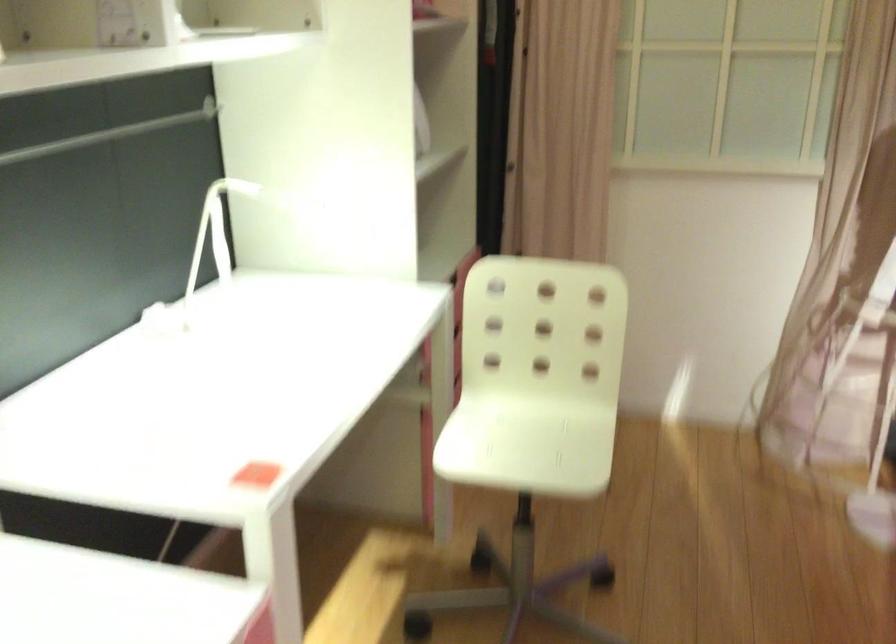
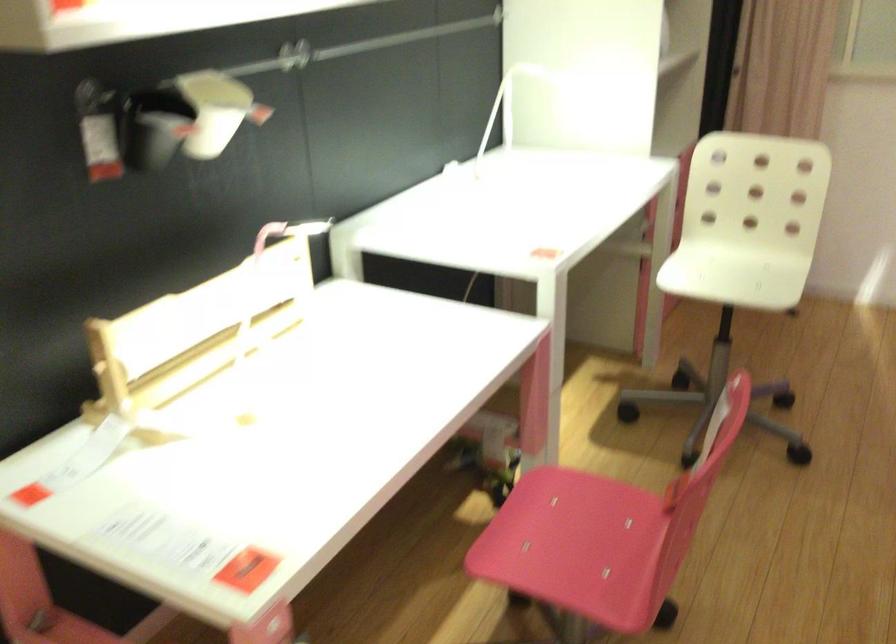
Question: The camera is either moving clockwise (left) or counter-clockwise (right) around the object. The first image is from the beginning of the video and the second image is from the end. Is the camera moving left or right when shooting the video?

Choices:
 (A) Left
 (B) Right

Answer: (B)